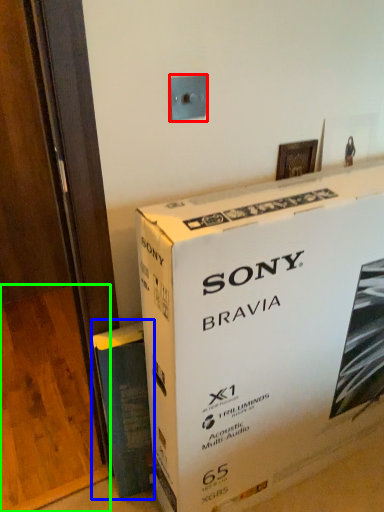
Question: Considering the real-world distances, which object is closest to electric outlet (highlighted by a red box)? paperback book (highlighted by a blue box) or plywood (highlighted by a green box).

Choices:
 (A) paperback book
 (B) plywood

Answer: (A)